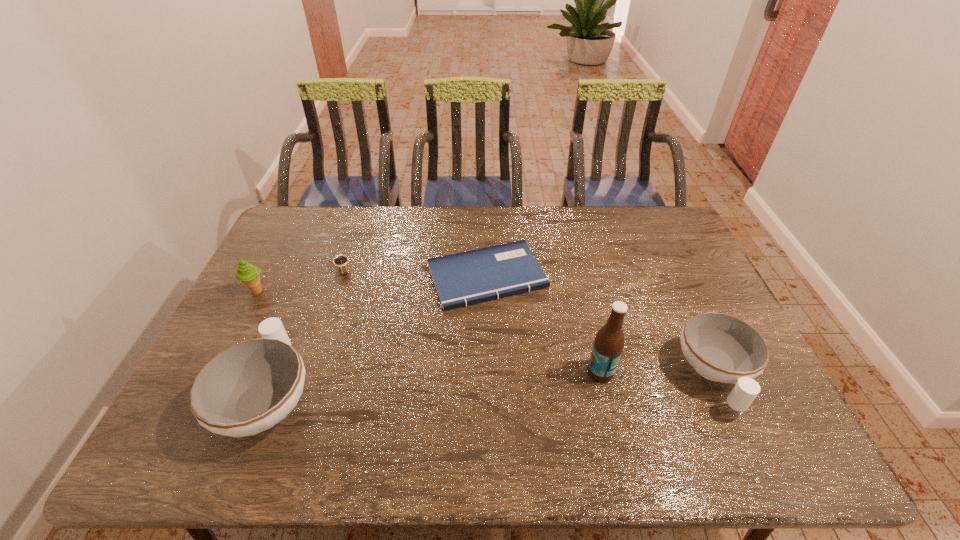
Image resolution: width=960 pixels, height=540 pixels. I want to click on vacant spot for a new chinaware to ensure equal spacing, so click(x=497, y=386).